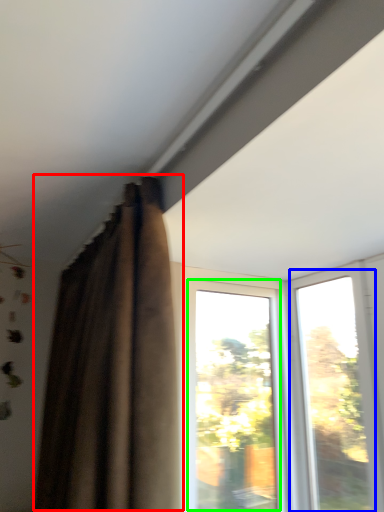
Question: Which object is the farthest from curtain (highlighted by a red box)? Choose among these: window (highlighted by a blue box) or window (highlighted by a green box).

Choices:
 (A) window
 (B) window

Answer: (A)